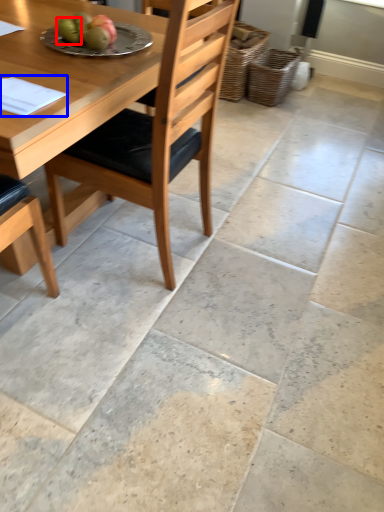
Question: Which object is closer to the camera taking this photo, fruit (highlighted by a red box) or notepad (highlighted by a blue box)?

Choices:
 (A) fruit
 (B) notepad

Answer: (B)